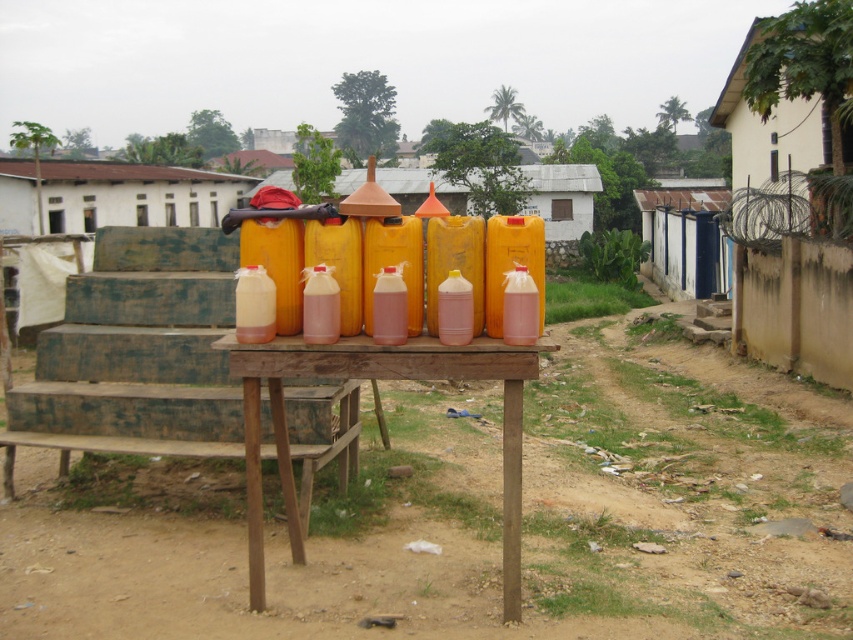
Question: Where is dirt field at lower center located in relation to wooden table at center in the image?

Choices:
 (A) above
 (B) below

Answer: (B)

Question: Does dirt field at lower center have a larger size compared to wooden table at center?

Choices:
 (A) yes
 (B) no

Answer: (A)

Question: Does dirt field at lower center appear under wooden table at center?

Choices:
 (A) yes
 (B) no

Answer: (A)

Question: Among these objects, which one is farthest from the camera?

Choices:
 (A) dirt field at lower center
 (B) wooden table at center

Answer: (A)

Question: Which object appears closest to the camera in this image?

Choices:
 (A) wooden table at center
 (B) dirt field at lower center

Answer: (A)